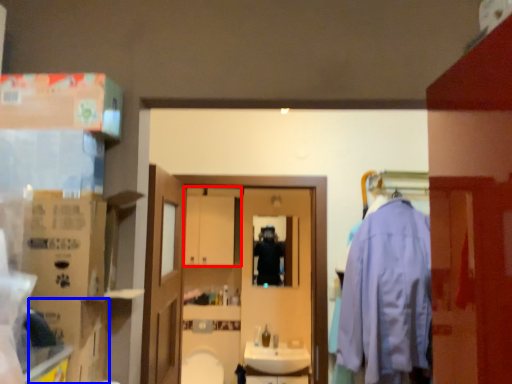
Question: Among these objects, which one is nearest to the camera, cabinetry (highlighted by a red box) or cardboard box (highlighted by a blue box)?

Choices:
 (A) cabinetry
 (B) cardboard box

Answer: (B)